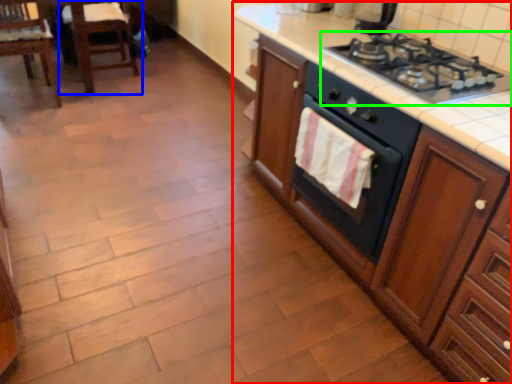
Question: Estimate the real-world distances between objects in this image. Which object is closer to cabinetry (highlighted by a red box), chair (highlighted by a blue box) or gas stove (highlighted by a green box)?

Choices:
 (A) chair
 (B) gas stove

Answer: (B)